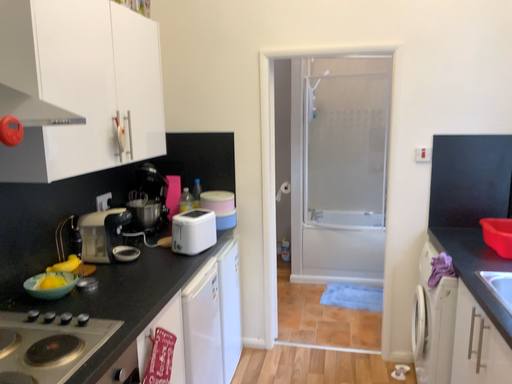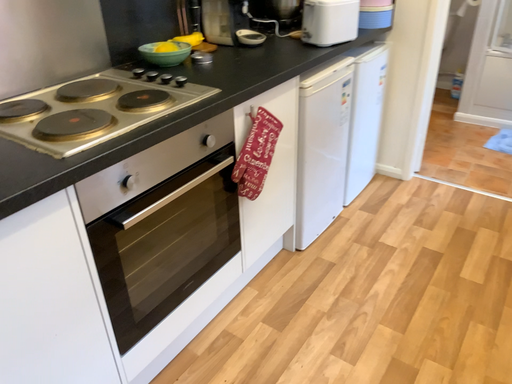
Question: How did the camera likely rotate when shooting the video?

Choices:
 (A) rotated left
 (B) rotated right

Answer: (A)